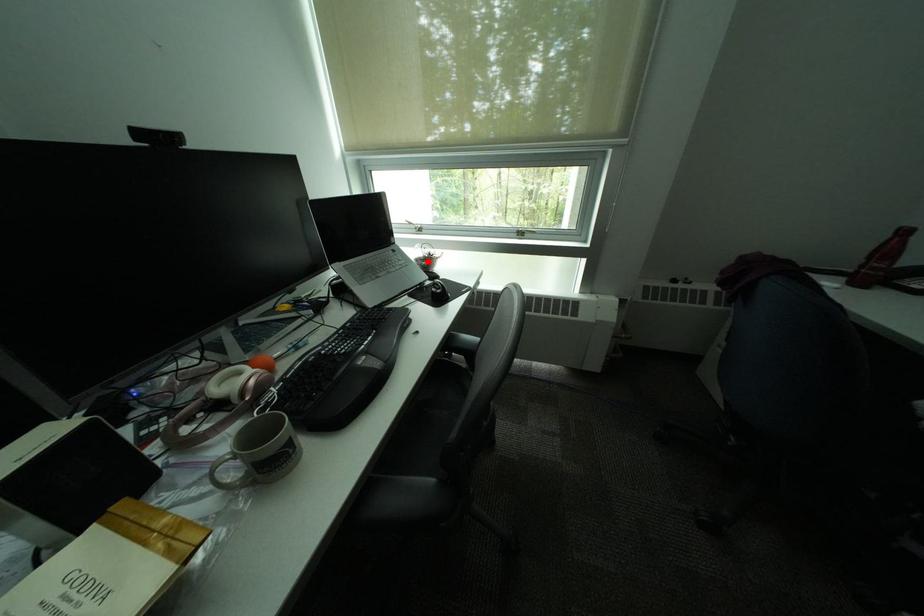
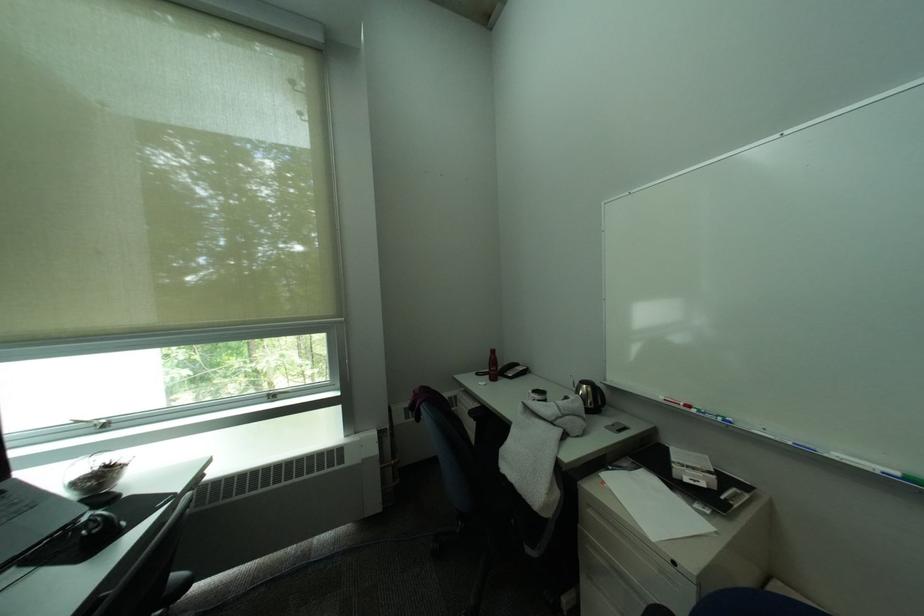
Where in the second image is the point corresponding to the highlighted location from the first image?

(84, 485)